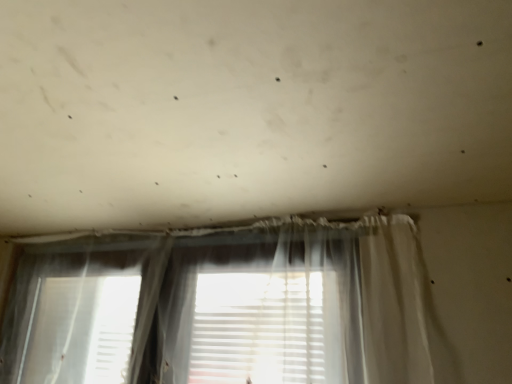
What do you see at coordinates (223, 307) in the screenshot?
I see `translucent fabric curtain at center` at bounding box center [223, 307].

At what (x,y) coordinates should I click in order to perform the action: click on translucent fabric curtain at center. Please return your answer as a coordinate pair (x, y). Looking at the image, I should click on (223, 307).

Where is `translucent fabric curtain at center`? The height and width of the screenshot is (384, 512). translucent fabric curtain at center is located at coordinates (223, 307).